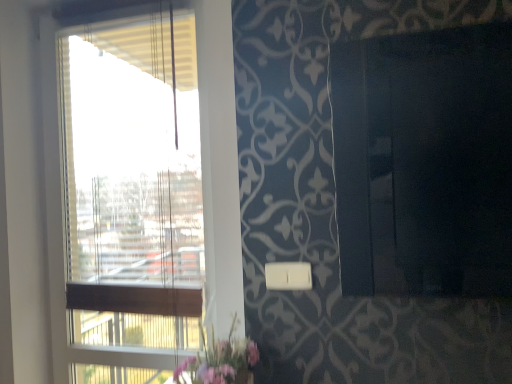
Question: Is pink fabric floral arrangement at lower center positioned beyond the bounds of white plastic light switch at lower center?

Choices:
 (A) yes
 (B) no

Answer: (A)

Question: Can you confirm if pink fabric floral arrangement at lower center is taller than white plastic light switch at lower center?

Choices:
 (A) yes
 (B) no

Answer: (A)

Question: Is pink fabric floral arrangement at lower center not near white plastic light switch at lower center?

Choices:
 (A) yes
 (B) no

Answer: (B)

Question: Are pink fabric floral arrangement at lower center and white plastic light switch at lower center beside each other?

Choices:
 (A) yes
 (B) no

Answer: (B)

Question: Can you confirm if pink fabric floral arrangement at lower center is wider than white plastic light switch at lower center?

Choices:
 (A) no
 (B) yes

Answer: (B)

Question: Would you say white plastic light switch at lower center is inside or outside transparent glass window at left?

Choices:
 (A) outside
 (B) inside

Answer: (A)

Question: Based on their sizes in the image, would you say white plastic light switch at lower center is bigger or smaller than transparent glass window at left?

Choices:
 (A) big
 (B) small

Answer: (B)

Question: Is white plastic light switch at lower center to the left or to the right of transparent glass window at left in the image?

Choices:
 (A) right
 (B) left

Answer: (A)

Question: Considering the positions of white plastic light switch at lower center and transparent glass window at left in the image, is white plastic light switch at lower center wider or thinner than transparent glass window at left?

Choices:
 (A) thin
 (B) wide

Answer: (A)

Question: Looking at their shapes, would you say pink fabric floral arrangement at lower center is wider or thinner than white plastic light switch at lower center?

Choices:
 (A) thin
 (B) wide

Answer: (B)

Question: From the image's perspective, is pink fabric floral arrangement at lower center located above or below white plastic light switch at lower center?

Choices:
 (A) above
 (B) below

Answer: (B)

Question: Considering their positions, is pink fabric floral arrangement at lower center located in front of or behind white plastic light switch at lower center?

Choices:
 (A) behind
 (B) front

Answer: (B)

Question: From a real-world perspective, is pink fabric floral arrangement at lower center above or below white plastic light switch at lower center?

Choices:
 (A) above
 (B) below

Answer: (B)

Question: Is point (140, 304) positioned closer to the camera than point (296, 276)?

Choices:
 (A) farther
 (B) closer

Answer: (A)

Question: Looking at their shapes, would you say transparent glass window at left is wider or thinner than white plastic light switch at lower center?

Choices:
 (A) thin
 (B) wide

Answer: (B)